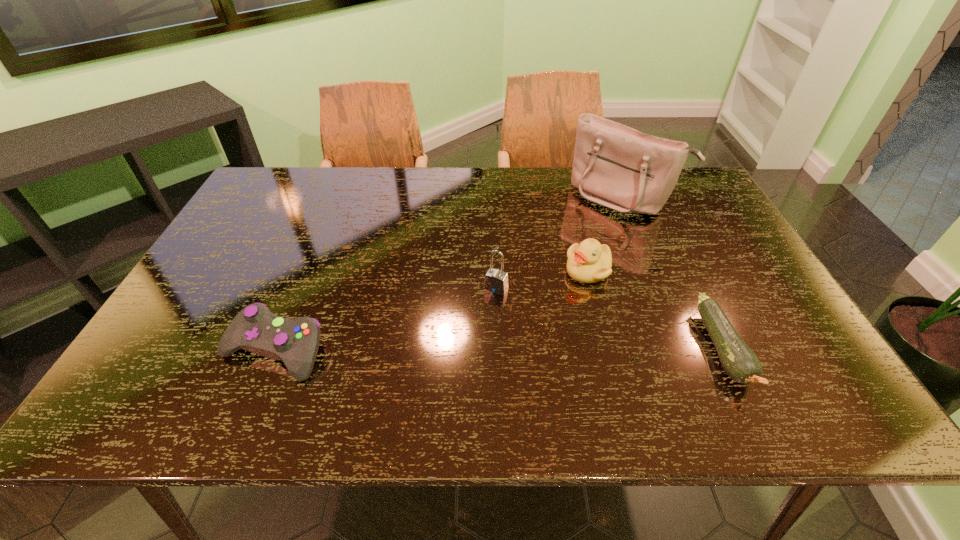
In order to click on vacant space at the right edge of the desktop in this screenshot , I will do `click(726, 302)`.

Image resolution: width=960 pixels, height=540 pixels. Find the location of `free space at the far left corner of the desktop`. free space at the far left corner of the desktop is located at coordinates (299, 201).

Find the location of `free space between the duckling and the shortest object`. free space between the duckling and the shortest object is located at coordinates (656, 310).

Image resolution: width=960 pixels, height=540 pixels. Identify the location of free space between the duckling and the control. (431, 310).

Image resolution: width=960 pixels, height=540 pixels. Identify the location of free space between the padlock and the zucchini. (610, 319).

At what (x,y) coordinates should I click in order to perform the action: click on vacant region between the farthest object and the leftmost object. Please return your answer as a coordinate pair (x, y). Looking at the image, I should click on (447, 273).

Locate an element on the screen. This screenshot has width=960, height=540. free space between the shortest object and the fourth tallest object is located at coordinates (498, 349).

Locate an element on the screen. This screenshot has width=960, height=540. vacant area between the third shortest object and the padlock is located at coordinates (542, 280).

Identify the location of unoccupied area between the duckling and the tallest object. (605, 234).

This screenshot has width=960, height=540. Find the location of `free space between the farthest object and the duckling`. free space between the farthest object and the duckling is located at coordinates (605, 234).